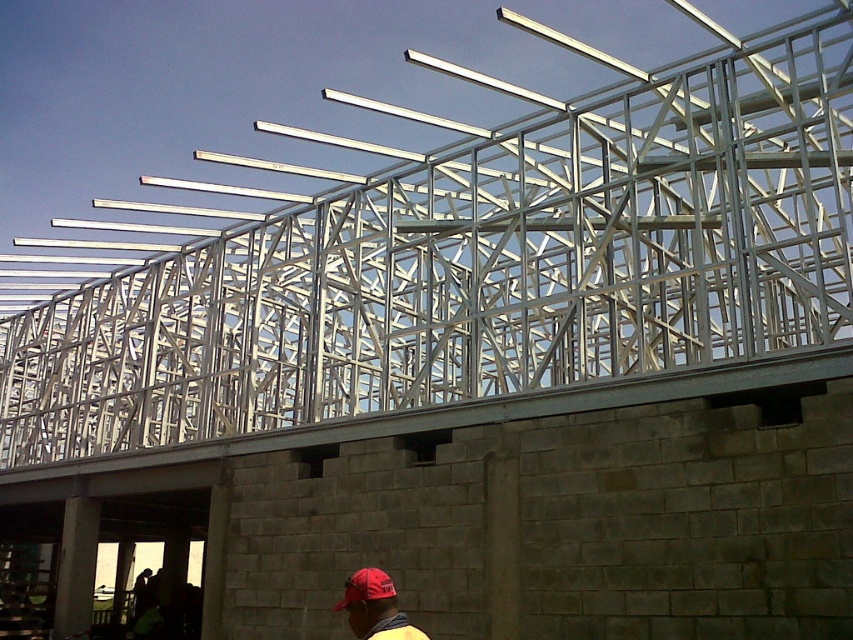
You are a construction worker standing at the base of the building framework. You need to place a 30 cm long metal rod between the matte red cap at lower center and the red matte baseball cap at lower center. Can you fit the rod horizontally between them?

The distance between the matte red cap at lower center and the red matte baseball cap at lower center is 29.46 centimeters. Since the rod is 30 cm long, it is slightly longer than the space available. Therefore, the rod cannot be placed horizontally between them without bending or adjusting the position.

You are a construction worker standing at the base of the building framework. You need to retrieve your safety gear. Which object is positioned lower between the matte red cap at lower center and the red matte baseball cap at lower center?

The matte red cap at lower center is positioned lower than the red matte baseball cap at lower center.

You are an inspector at the construction site. You notice two safety caps in the scene. Which one is taller, the matte red cap at lower center or the red matte baseball cap at lower center?

The matte red cap at lower center is taller than the red matte baseball cap at lower center according to the description.